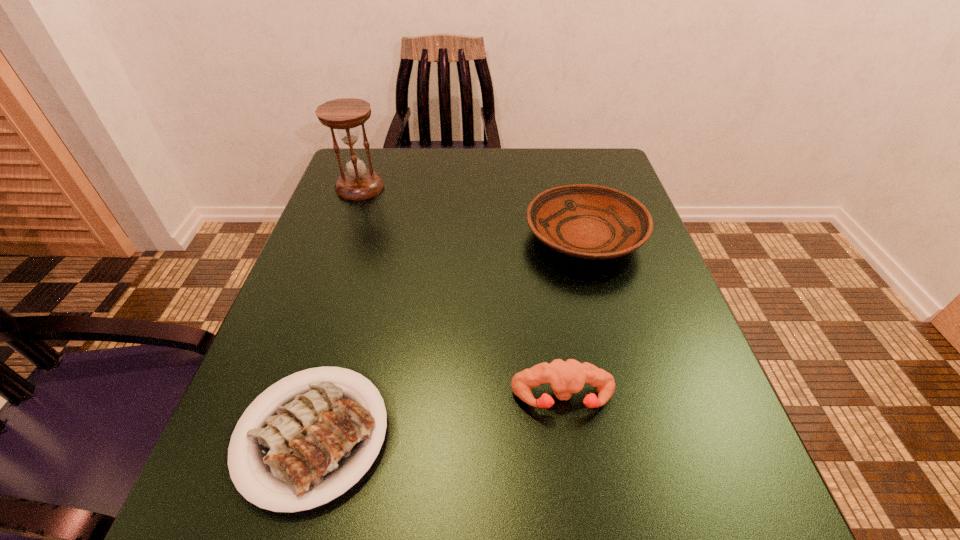
Identify the location of free space at the near edge of the desktop. The height and width of the screenshot is (540, 960). (522, 513).

This screenshot has width=960, height=540. In order to click on vacant point at the left edge in this screenshot , I will do click(383, 256).

Where is `free point at the right edge`? free point at the right edge is located at coordinates (672, 394).

I want to click on vacant space at the near left corner, so click(x=298, y=531).

In the image, there is a desktop. Identify the location of vacant region at the far right corner. The width and height of the screenshot is (960, 540). (603, 163).

You are a GUI agent. You are given a task and a screenshot of the screen. Output one action in this format:
    pyautogui.click(x=<x>, y=<y>)
    Task: Click on the free spot between the hourglass and the puncher
    
    Given the screenshot: What is the action you would take?
    pyautogui.click(x=462, y=293)

Where is `free spot between the right plate and the shortest object`? The width and height of the screenshot is (960, 540). free spot between the right plate and the shortest object is located at coordinates (448, 336).

You are a GUI agent. You are given a task and a screenshot of the screen. Output one action in this format:
    pyautogui.click(x=<x>, y=<y>)
    Task: Click on the vacant area that lies between the shortest object and the puncher
    The height and width of the screenshot is (540, 960).
    Given the screenshot: What is the action you would take?
    pyautogui.click(x=438, y=417)

Image resolution: width=960 pixels, height=540 pixels. Find the location of `vacant area that lies between the left plate and the taller plate`. vacant area that lies between the left plate and the taller plate is located at coordinates pyautogui.click(x=448, y=336).

Locate an element on the screen. free space between the puncher and the farther plate is located at coordinates (573, 318).